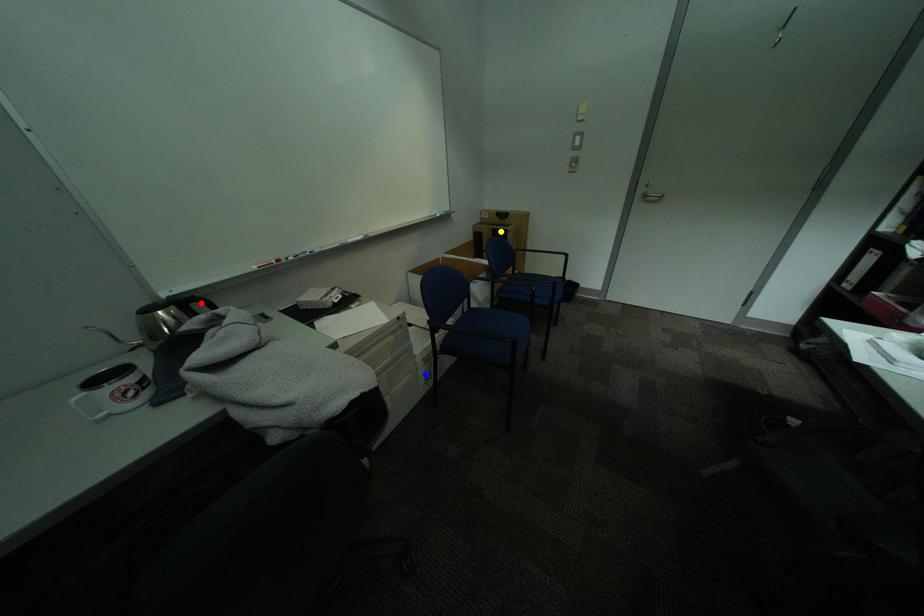
Order these from nearest to farthest:
red point, blue point, yellow point

red point → blue point → yellow point